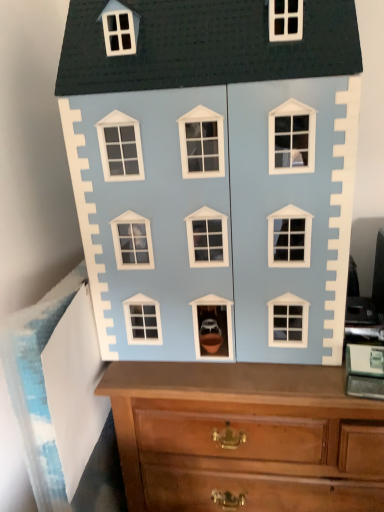
Question: Is light blue matte house at center in front of or behind wooden chest of drawers at center in the image?

Choices:
 (A) behind
 (B) front

Answer: (B)

Question: In the image, is light blue matte house at center on the left side or the right side of wooden chest of drawers at center?

Choices:
 (A) right
 (B) left

Answer: (B)

Question: Considering the positions of light blue matte house at center and wooden chest of drawers at center in the image, is light blue matte house at center wider or thinner than wooden chest of drawers at center?

Choices:
 (A) thin
 (B) wide

Answer: (A)

Question: Considering their positions, is wooden chest of drawers at center located in front of or behind light blue matte house at center?

Choices:
 (A) behind
 (B) front

Answer: (A)

Question: From their relative heights in the image, would you say wooden chest of drawers at center is taller or shorter than light blue matte house at center?

Choices:
 (A) short
 (B) tall

Answer: (B)

Question: From a real-world perspective, relative to light blue matte house at center, is wooden chest of drawers at center vertically above or below?

Choices:
 (A) below
 (B) above

Answer: (A)

Question: Is wooden chest of drawers at center bigger or smaller than light blue matte house at center?

Choices:
 (A) big
 (B) small

Answer: (A)